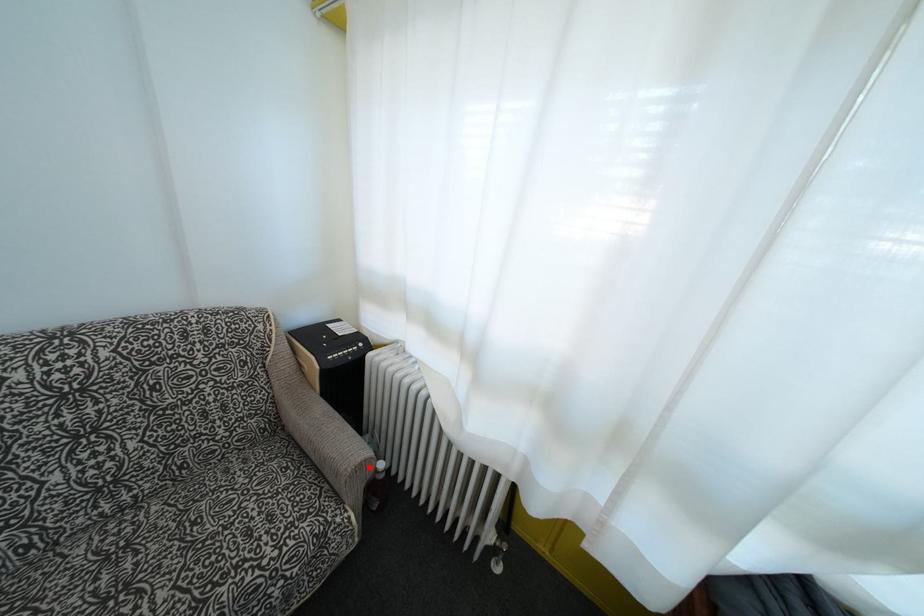
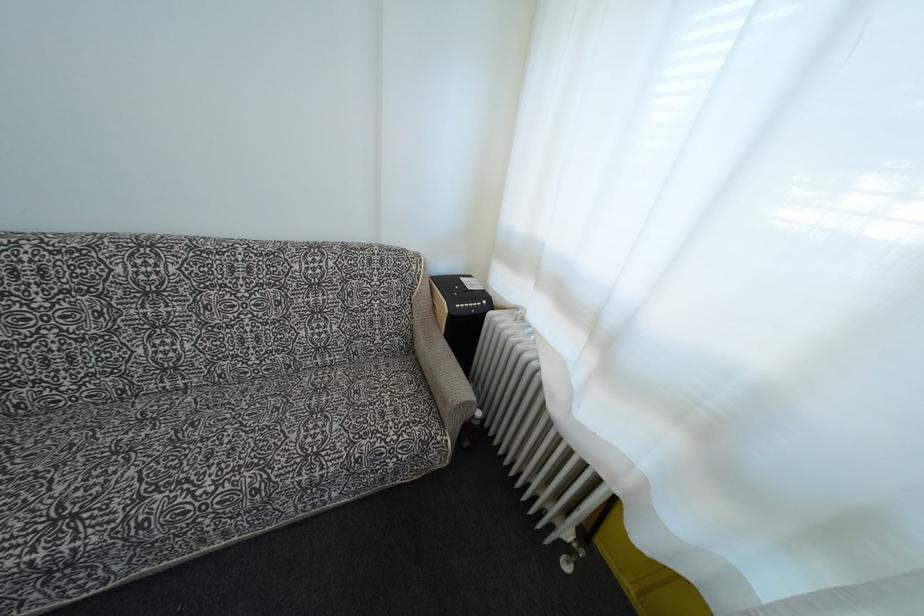
Question: I am providing you with two images of the same scene from different viewpoints. In image1, a red point is highlighted. Considering the same 3D point in image2, which of the following is correct?

Choices:
 (A) It is closer
 (B) It is farther

Answer: (B)